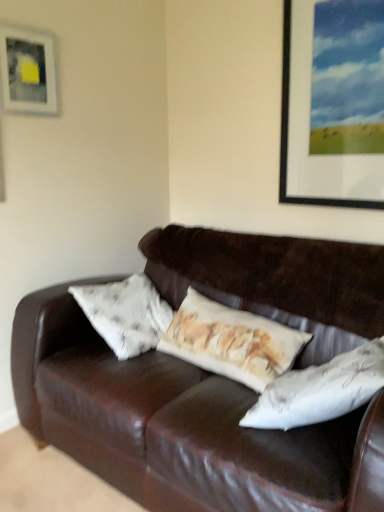
Question: Can we say metallic silver picture frame at upper right, placed as the 2th picture frame when sorted from left to right, lies outside matte white picture frame at upper left, placed as the first picture frame when sorted from left to right?

Choices:
 (A) yes
 (B) no

Answer: (A)

Question: From the image's perspective, does metallic silver picture frame at upper right, placed as the 2th picture frame when sorted from left to right, appear lower than matte white picture frame at upper left, placed as the first picture frame when sorted from left to right?

Choices:
 (A) no
 (B) yes

Answer: (B)

Question: Can you confirm if metallic silver picture frame at upper right, placed as the 2th picture frame when sorted from left to right, is taller than matte white picture frame at upper left, placed as the first picture frame when sorted from left to right?

Choices:
 (A) yes
 (B) no

Answer: (A)

Question: Is metallic silver picture frame at upper right, the first picture frame from the right, bigger than matte white picture frame at upper left, placed as the first picture frame when sorted from left to right?

Choices:
 (A) yes
 (B) no

Answer: (A)

Question: Is matte white picture frame at upper left, positioned as the second picture frame in right-to-left order, a part of metallic silver picture frame at upper right, placed as the 2th picture frame when sorted from left to right?

Choices:
 (A) yes
 (B) no

Answer: (B)

Question: Is matte white picture frame at upper left, positioned as the second picture frame in right-to-left order, at the back of metallic silver picture frame at upper right, placed as the 2th picture frame when sorted from left to right?

Choices:
 (A) no
 (B) yes

Answer: (A)

Question: Is matte white picture frame at upper left, placed as the first picture frame when sorted from left to right, not close to metallic silver picture frame at upper right, placed as the 2th picture frame when sorted from left to right?

Choices:
 (A) yes
 (B) no

Answer: (A)

Question: From the image's perspective, is matte white picture frame at upper left, placed as the first picture frame when sorted from left to right, under metallic silver picture frame at upper right, the first picture frame from the right?

Choices:
 (A) yes
 (B) no

Answer: (B)

Question: Is metallic silver picture frame at upper right, placed as the 2th picture frame when sorted from left to right, completely or partially inside matte white picture frame at upper left, placed as the first picture frame when sorted from left to right?

Choices:
 (A) no
 (B) yes

Answer: (A)

Question: Does matte white picture frame at upper left, positioned as the second picture frame in right-to-left order, lie behind metallic silver picture frame at upper right, placed as the 2th picture frame when sorted from left to right?

Choices:
 (A) no
 (B) yes

Answer: (B)

Question: Is matte white picture frame at upper left, positioned as the second picture frame in right-to-left order, positioned with its back to metallic silver picture frame at upper right, the first picture frame from the right?

Choices:
 (A) yes
 (B) no

Answer: (B)

Question: From a real-world perspective, is matte white picture frame at upper left, positioned as the second picture frame in right-to-left order, beneath metallic silver picture frame at upper right, placed as the 2th picture frame when sorted from left to right?

Choices:
 (A) no
 (B) yes

Answer: (A)

Question: From the image's perspective, relative to metallic silver picture frame at upper right, the first picture frame from the right, is matte white picture frame at upper left, placed as the first picture frame when sorted from left to right, above or below?

Choices:
 (A) below
 (B) above

Answer: (B)